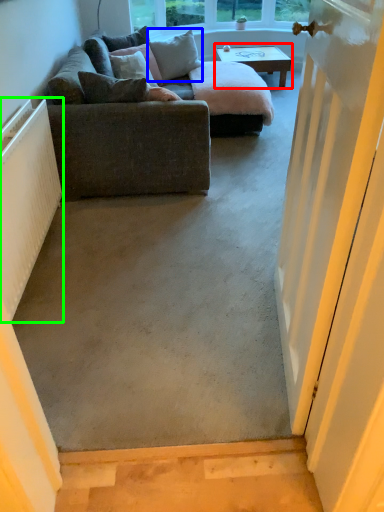
Question: Which object is the closest to the coffee table (highlighted by a red box)? Choose among these: pillow (highlighted by a blue box) or radiator (highlighted by a green box).

Choices:
 (A) pillow
 (B) radiator

Answer: (A)